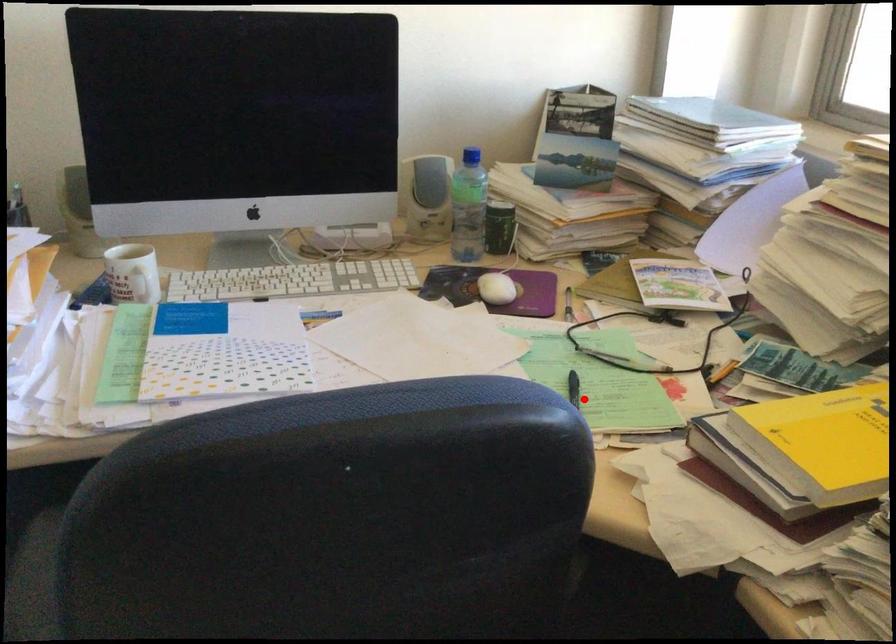
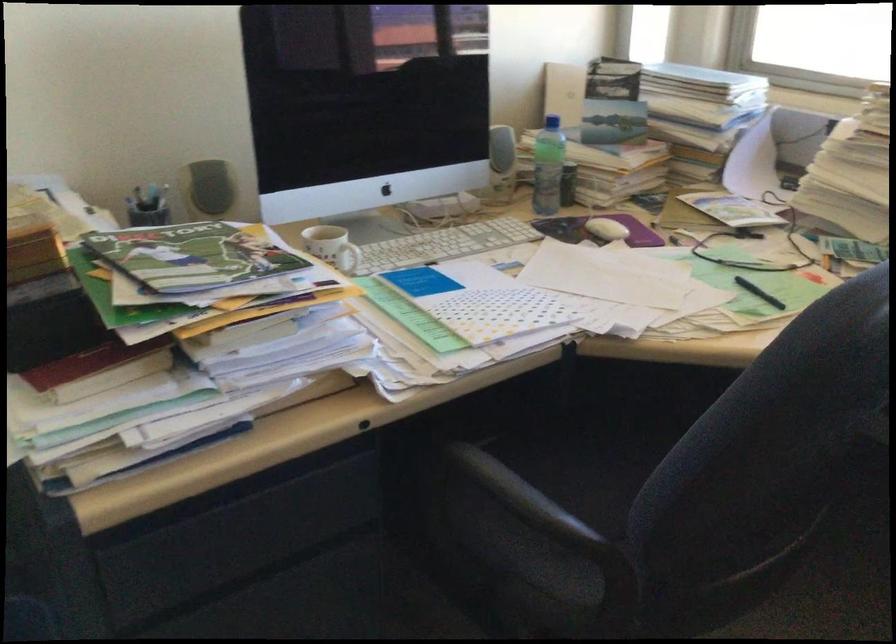
Where in the second image is the point corresponding to the highlighted location from the first image?

(759, 292)